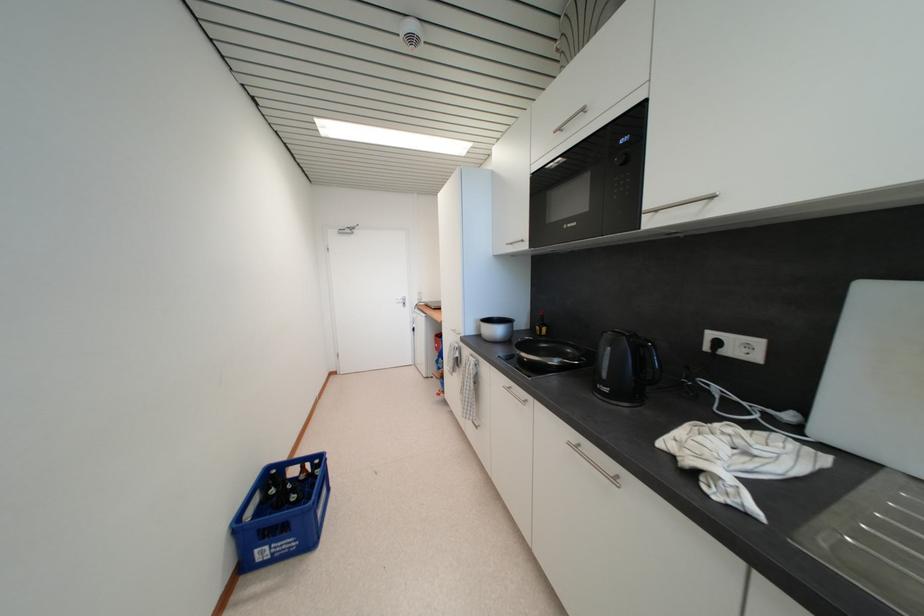
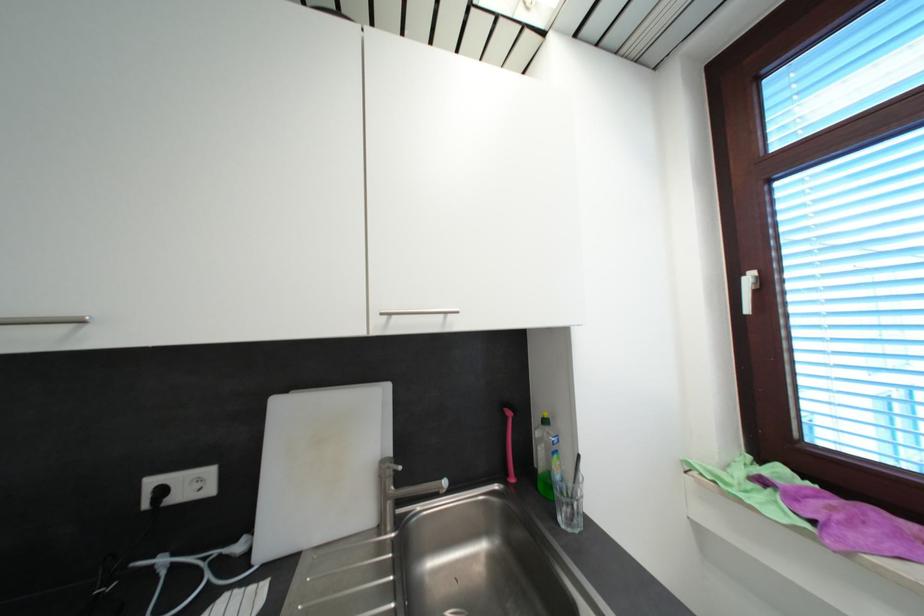
In the second image, find the point that corresponds to (821,437) in the first image.

(265, 559)